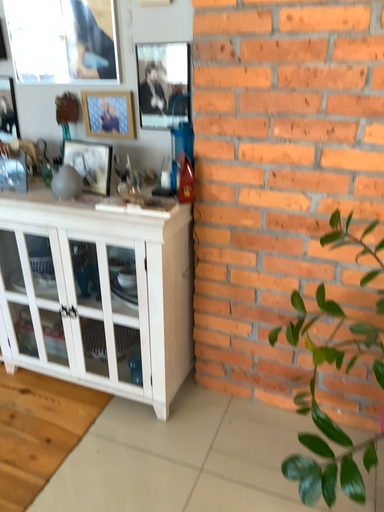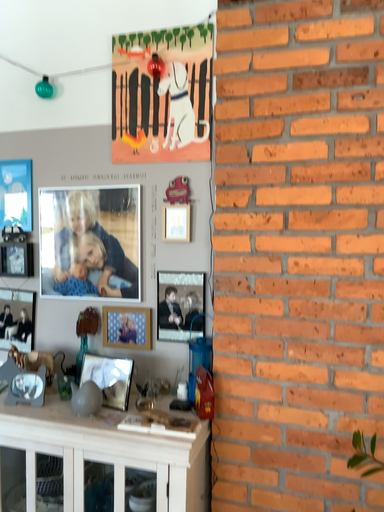
Question: Which way did the camera rotate in the video?

Choices:
 (A) rotated downward
 (B) rotated upward

Answer: (B)